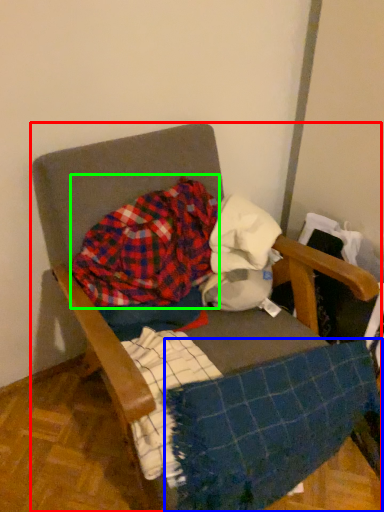
Question: Which object is positioned closest to chair (highlighted by a red box)? Select from blanket (highlighted by a blue box) and flannel (highlighted by a green box).

Choices:
 (A) blanket
 (B) flannel

Answer: (B)